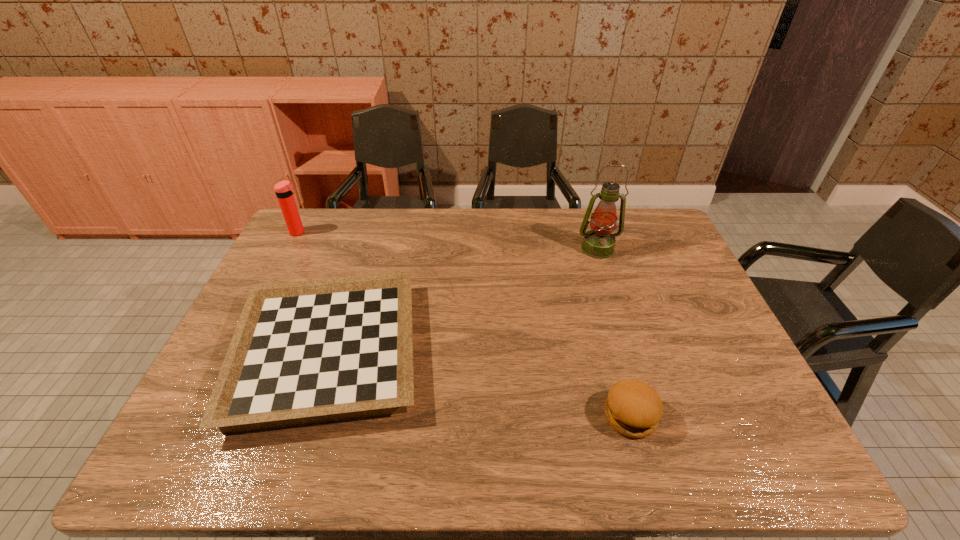
The height and width of the screenshot is (540, 960). I want to click on free space at the right edge of the desktop, so click(684, 274).

Where is `vacant space at the near left corner of the desktop`? vacant space at the near left corner of the desktop is located at coordinates (198, 469).

At what (x,y) coordinates should I click in order to perform the action: click on blank space at the far right corner. Please return your answer as a coordinate pair (x, y). The image size is (960, 540). Looking at the image, I should click on (630, 229).

The width and height of the screenshot is (960, 540). In the image, there is a desktop. What are the coordinates of `free region at the near right corner` in the screenshot? It's located at (715, 453).

The height and width of the screenshot is (540, 960). What are the coordinates of `free space between the hamburger and the tallest object` in the screenshot? It's located at (x=613, y=332).

This screenshot has height=540, width=960. Find the location of `vacant area between the farthest object and the tallest object`. vacant area between the farthest object and the tallest object is located at coordinates (448, 240).

The width and height of the screenshot is (960, 540). Identify the location of blank region between the hamburger and the checkerboard. (479, 384).

Locate an element on the screen. The height and width of the screenshot is (540, 960). free space between the third shortest object and the hamburger is located at coordinates (464, 324).

This screenshot has width=960, height=540. Find the location of `free spot between the oil lamp and the farthest object`. free spot between the oil lamp and the farthest object is located at coordinates (448, 240).

Find the location of `blank region between the farthest object and the second farthest object`. blank region between the farthest object and the second farthest object is located at coordinates (448, 240).